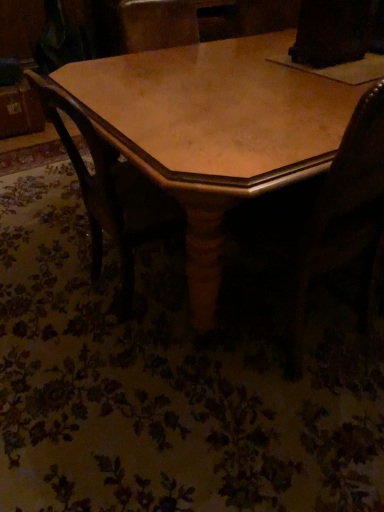
Find the location of `wooden table at center`. wooden table at center is located at coordinates (213, 130).

Find the location of a particular element. wooden table at center is located at coordinates (213, 130).

Is wooden table at center positioned with its back to wooden swivel chair at center?

No.

Would you say wooden table at center is a long distance from wooden swivel chair at center?

That's not correct — wooden table at center is a little close to wooden swivel chair at center.

Who is smaller, wooden table at center or wooden swivel chair at center?

wooden swivel chair at center.

Considering the sizes of objects wooden table at center and wooden chair at center in the image provided, who is taller, wooden table at center or wooden chair at center?

Standing taller between the two is wooden chair at center.

Is wooden table at center further to camera compared to wooden chair at center?

No, the depth of wooden table at center is less than that of wooden chair at center.

Considering the points (218, 208) and (42, 106), which point is in front, point (218, 208) or point (42, 106)?

The point (218, 208) is closer to the camera.

Is wooden chair at center located within wooden table at center?

Yes, wooden chair at center is a part of wooden table at center.

Based on their positions, is wooden swivel chair at center located to the left or right of wooden table at center?

From the image, it's evident that wooden swivel chair at center is to the left of wooden table at center.

From a real-world perspective, which is physically below, wooden swivel chair at center or wooden table at center?

wooden table at center is physically lower.

Which is behind, wooden swivel chair at center or wooden table at center?

Positioned behind is wooden table at center.

From the image's perspective, is wooden swivel chair at center beneath wooden table at center?

Yes.

From a real-world perspective, is wooden swivel chair at center positioned under wooden chair at center based on gravity?

No, from a real-world perspective, wooden swivel chair at center is not beneath wooden chair at center.

Is wooden swivel chair at center taller than wooden chair at center?

Yes.

The height and width of the screenshot is (512, 384). In order to click on chair located above the wooden swivel chair at center (from the image's perspective) in this screenshot , I will do `click(110, 192)`.

Is wooden chair at center turned away from wooden table at center?

Correct, wooden chair at center is looking away from wooden table at center.

How many degrees apart are the facing directions of wooden chair at center and wooden table at center?

The angular difference between wooden chair at center and wooden table at center is 1.95 degrees.

Is wooden chair at center bigger than wooden table at center?

Actually, wooden chair at center might be smaller than wooden table at center.

Can you confirm if wooden chair at center is taller than wooden table at center?

Indeed, wooden chair at center has a greater height compared to wooden table at center.

In the scene shown: Is wooden chair at center turned away from wooden swivel chair at center?

No.

Considering the relative sizes of wooden chair at center and wooden swivel chair at center in the image provided, is wooden chair at center wider than wooden swivel chair at center?

Yes, wooden chair at center is wider than wooden swivel chair at center.

From a real-world perspective, is wooden chair at center under wooden swivel chair at center?

Indeed, from a real-world perspective, wooden chair at center is positioned beneath wooden swivel chair at center.

Is wooden chair at center positioned in front of wooden swivel chair at center?

That is False.

In the image, there is a wooden swivel chair at center. Where is `table above it (from the image's perspective)`? This screenshot has height=512, width=384. table above it (from the image's perspective) is located at coordinates (213, 130).

I want to click on chair located below the wooden table at center (from the image's perspective), so click(110, 192).

Based on their spatial positions, is wooden chair at center or wooden table at center further from wooden swivel chair at center?

Based on the image, wooden chair at center appears to be further to wooden swivel chair at center.

When comparing their distances from wooden swivel chair at center, does wooden table at center or wooden chair at center seem closer?

wooden table at center lies closer to wooden swivel chair at center than the other object.

Which object lies nearer to the anchor point wooden chair at center, wooden table at center or wooden swivel chair at center?

wooden table at center is closer to wooden chair at center.

Looking at the image, which one is located further to wooden table at center, wooden chair at center or wooden swivel chair at center?

wooden swivel chair at center.

Looking at the image, which one is located further to wooden chair at center, wooden swivel chair at center or wooden table at center?

wooden swivel chair at center lies further to wooden chair at center than the other object.

Looking at the image, which one is located closer to wooden table at center, wooden swivel chair at center or wooden chair at center?

The object closer to wooden table at center is wooden chair at center.

Where is `swivel chair between wooden chair at center and wooden table at center in the horizontal direction`? swivel chair between wooden chair at center and wooden table at center in the horizontal direction is located at coordinates (343, 219).